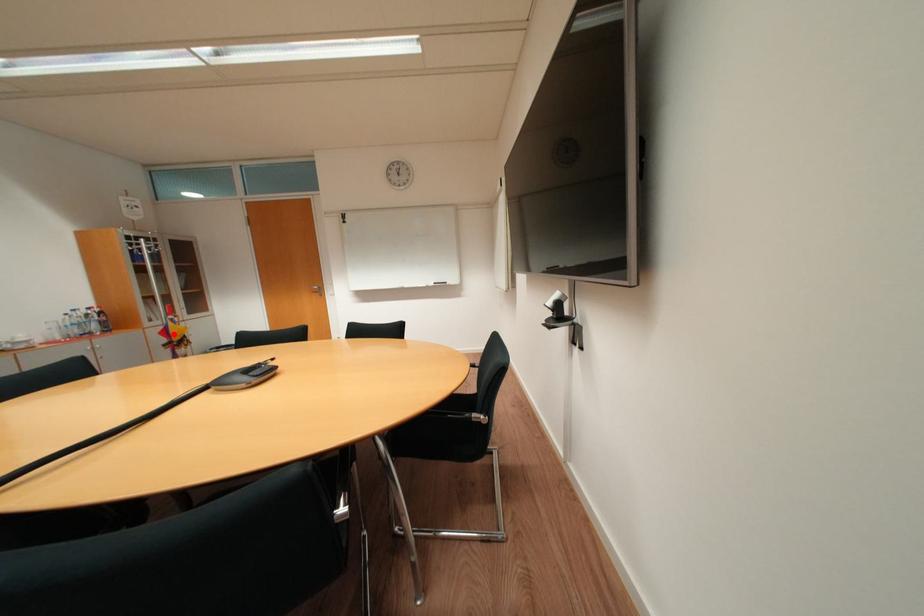
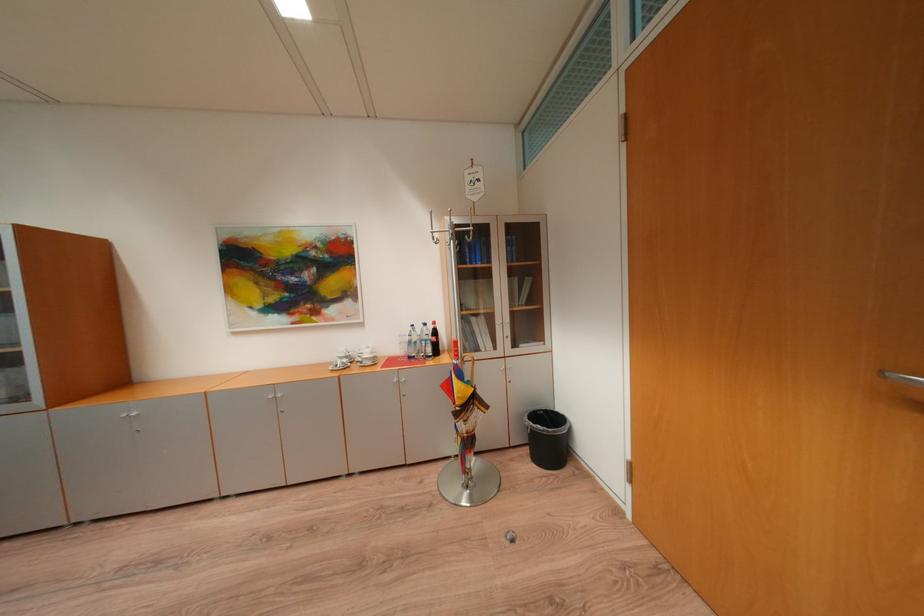
In the second image, find the point that corresponds to the highlighted location in the first image.

(456, 387)